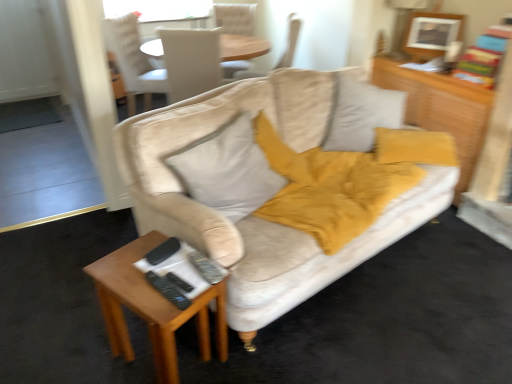
In order to click on vacant space situated on the left part of wooden rectangular table at lower left in this screenshot , I will do `click(82, 350)`.